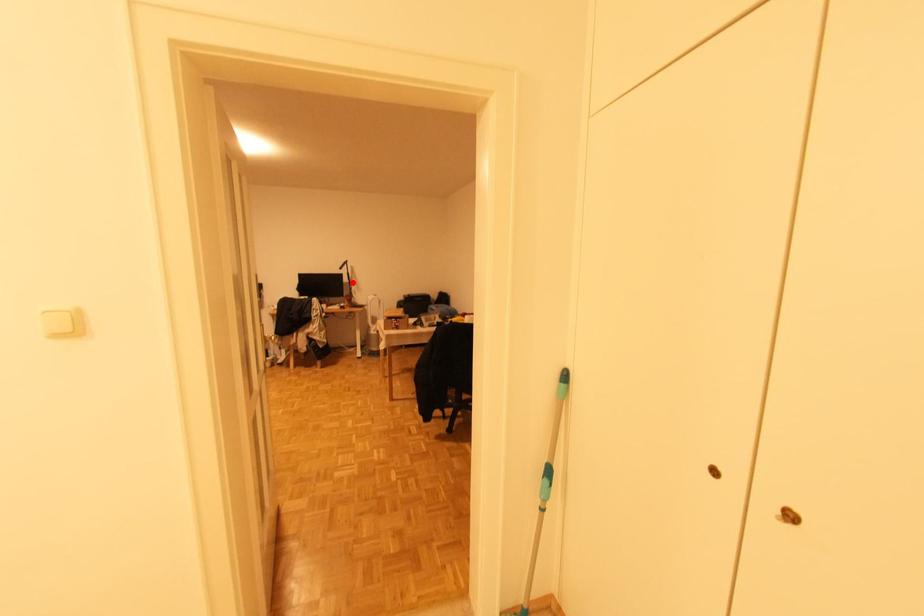
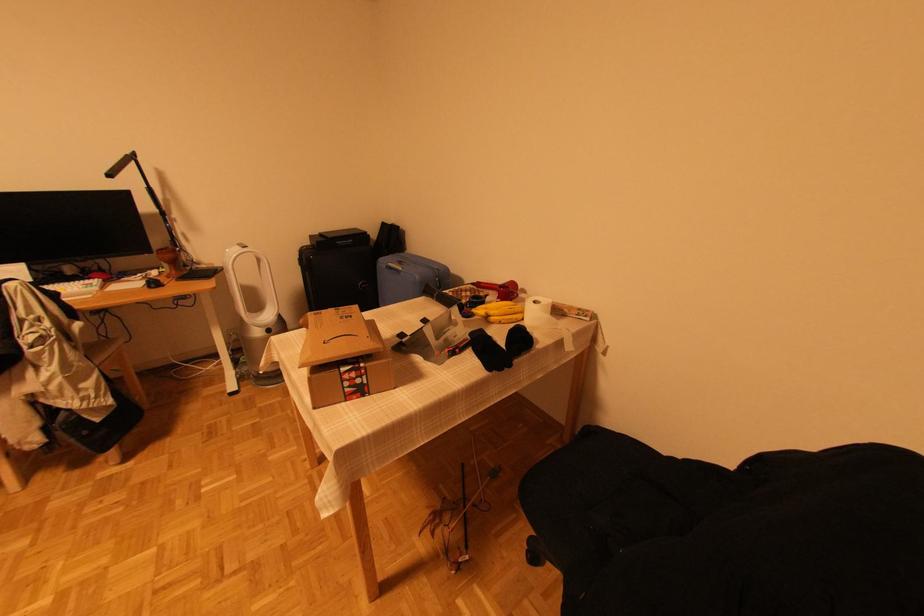
Question: I am providing you with two images of the same scene from different viewpoints. Image1 has a red point marked. In image2, the corresponding 3D location appears at what relative position? Reply with the corresponding letter.

Choices:
 (A) Closer
 (B) Farther

Answer: (B)